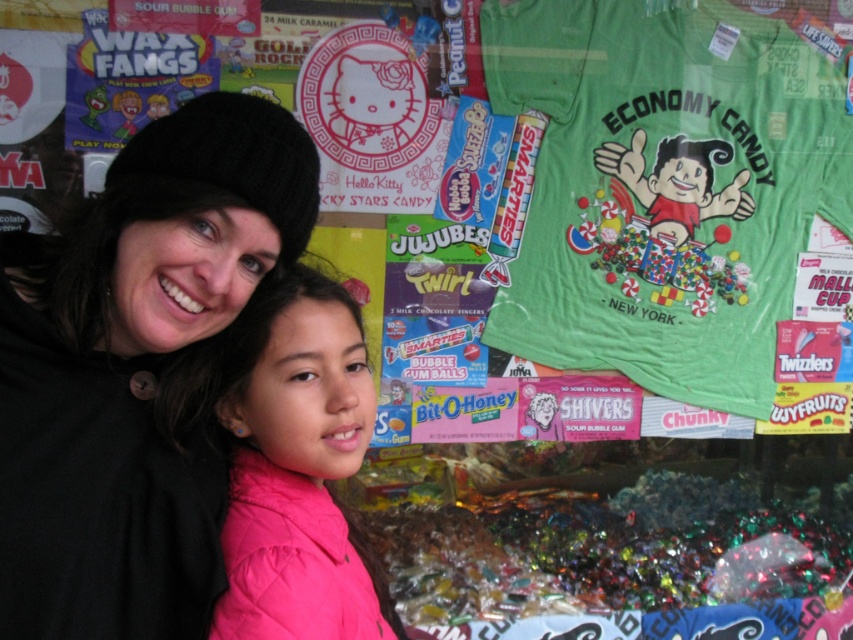
Question: Considering the relative positions of black knit hat at upper left and pink quilted jacket at center in the image provided, where is black knit hat at upper left located with respect to pink quilted jacket at center?

Choices:
 (A) above
 (B) below

Answer: (A)

Question: Is black knit hat at upper left thinner than pink quilted jacket at center?

Choices:
 (A) no
 (B) yes

Answer: (A)

Question: Considering the relative positions of black knit hat at upper left and pink quilted jacket at center in the image provided, where is black knit hat at upper left located with respect to pink quilted jacket at center?

Choices:
 (A) below
 (B) above

Answer: (B)

Question: Which point is closer to the camera?

Choices:
 (A) black knit hat at upper left
 (B) pink quilted jacket at center

Answer: (A)